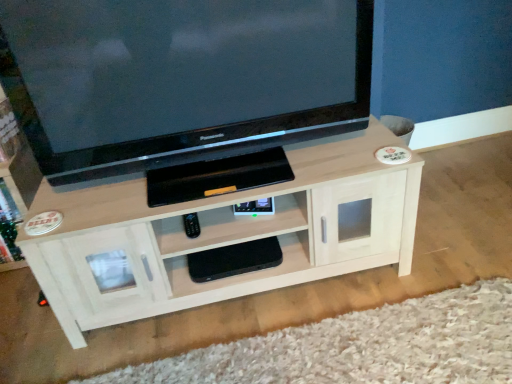
Identify the location of vacant space underneath black glossy television at upper center (from a real-world perspective). (223, 177).